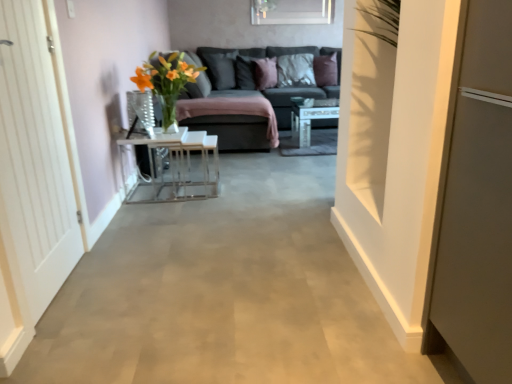
Question: Should I look upward or downward to see suede-like gray pillow at center, placed as the 1th pillow when sorted from left to right?

Choices:
 (A) up
 (B) down

Answer: (A)

Question: Can you confirm if dark gray fabric couch at center is smaller than purple velvet pillow at upper center, which is counted as the first pillow, starting from the right?

Choices:
 (A) no
 (B) yes

Answer: (A)

Question: Can you confirm if dark gray fabric couch at center is taller than purple velvet pillow at upper center, marked as the 5th pillow in a left-to-right arrangement?

Choices:
 (A) yes
 (B) no

Answer: (A)

Question: Would you consider dark gray fabric couch at center to be distant from purple velvet pillow at upper center, which is counted as the first pillow, starting from the right?

Choices:
 (A) no
 (B) yes

Answer: (B)

Question: Is purple velvet pillow at upper center, marked as the 5th pillow in a left-to-right arrangement, surrounded by dark gray fabric couch at center?

Choices:
 (A) yes
 (B) no

Answer: (A)

Question: Are dark gray fabric couch at center and purple velvet pillow at upper center, which is counted as the first pillow, starting from the right, beside each other?

Choices:
 (A) no
 (B) yes

Answer: (A)

Question: Does dark gray fabric couch at center have a lesser height compared to purple velvet pillow at upper center, which is counted as the first pillow, starting from the right?

Choices:
 (A) no
 (B) yes

Answer: (A)

Question: Is clear glass vase at center positioned before velvet dark gray pillow at center, the second pillow viewed from the right?

Choices:
 (A) no
 (B) yes

Answer: (B)

Question: From a real-world perspective, is clear glass vase at center positioned over velvet dark gray pillow at center, the fourth pillow in the left-to-right sequence, based on gravity?

Choices:
 (A) no
 (B) yes

Answer: (A)

Question: From the image's perspective, would you say clear glass vase at center is shown under velvet dark gray pillow at center, the fourth pillow in the left-to-right sequence?

Choices:
 (A) yes
 (B) no

Answer: (A)

Question: Considering the relative sizes of clear glass vase at center and velvet dark gray pillow at center, the second pillow viewed from the right, in the image provided, is clear glass vase at center taller than velvet dark gray pillow at center, the second pillow viewed from the right,?

Choices:
 (A) yes
 (B) no

Answer: (B)

Question: Can we say clear glass vase at center lies outside velvet dark gray pillow at center, the fourth pillow in the left-to-right sequence?

Choices:
 (A) no
 (B) yes

Answer: (B)

Question: Does clear glass vase at center contain velvet dark gray pillow at center, the fourth pillow in the left-to-right sequence?

Choices:
 (A) no
 (B) yes

Answer: (A)

Question: Are purple velvet pillow at center, the third pillow viewed from the right, and clear glass vase at center far apart?

Choices:
 (A) yes
 (B) no

Answer: (A)